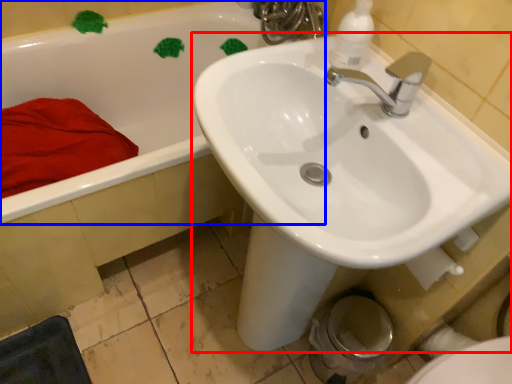
Question: Which object appears closest to the camera in this image, sink (highlighted by a red box) or bathtub (highlighted by a blue box)?

Choices:
 (A) sink
 (B) bathtub

Answer: (A)